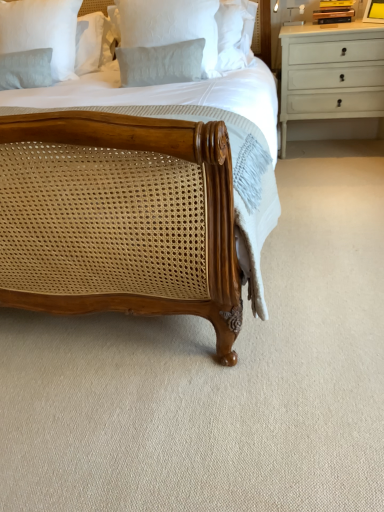
Question: From the image's perspective, is light gray textured pillow at upper left, positioned as the first pillow in left-to-right order, located above yellow matte picture frame at upper right?

Choices:
 (A) no
 (B) yes

Answer: (A)

Question: Is yellow matte picture frame at upper right surrounded by light gray textured pillow at upper left, arranged as the 1th pillow when viewed from the back?

Choices:
 (A) yes
 (B) no

Answer: (B)

Question: From the image's perspective, does light gray textured pillow at upper left, which is the second pillow from right to left, appear lower than yellow matte picture frame at upper right?

Choices:
 (A) yes
 (B) no

Answer: (A)

Question: From a real-world perspective, is light gray textured pillow at upper left, positioned as the first pillow in left-to-right order, on top of yellow matte picture frame at upper right?

Choices:
 (A) yes
 (B) no

Answer: (B)

Question: Considering the relative sizes of light gray textured pillow at upper left, arranged as the 1th pillow when viewed from the back, and yellow matte picture frame at upper right in the image provided, is light gray textured pillow at upper left, arranged as the 1th pillow when viewed from the back, smaller than yellow matte picture frame at upper right?

Choices:
 (A) yes
 (B) no

Answer: (B)

Question: Is point (211, 39) closer or farther from the camera than point (369, 19)?

Choices:
 (A) closer
 (B) farther

Answer: (A)

Question: Relative to yellow matte picture frame at upper right, is white textured pillow at upper center, the second pillow positioned from the left, in front or behind?

Choices:
 (A) front
 (B) behind

Answer: (A)

Question: Is white textured pillow at upper center, which is counted as the 2th pillow, starting from the back, taller or shorter than yellow matte picture frame at upper right?

Choices:
 (A) short
 (B) tall

Answer: (B)

Question: From a real-world perspective, is white textured pillow at upper center, the 1th pillow positioned from the front, physically located above or below yellow matte picture frame at upper right?

Choices:
 (A) above
 (B) below

Answer: (B)

Question: Considering the positions of white textured pillow at upper center, the second pillow positioned from the left, and light gray textured pillow at upper left, arranged as the 1th pillow when viewed from the back, in the image, is white textured pillow at upper center, the second pillow positioned from the left, taller or shorter than light gray textured pillow at upper left, arranged as the 1th pillow when viewed from the back,?

Choices:
 (A) tall
 (B) short

Answer: (B)

Question: From the image's perspective, is white textured pillow at upper center, the 1th pillow positioned from the front, located above or below light gray textured pillow at upper left, arranged as the 1th pillow when viewed from the back?

Choices:
 (A) below
 (B) above

Answer: (A)

Question: Looking at their shapes, would you say white textured pillow at upper center, placed as the first pillow when sorted from right to left, is wider or thinner than light gray textured pillow at upper left, the 2th pillow positioned from the front?

Choices:
 (A) thin
 (B) wide

Answer: (A)

Question: In the image, is white textured pillow at upper center, which is counted as the 2th pillow, starting from the back, on the left side or the right side of light gray textured pillow at upper left, which is the second pillow from right to left?

Choices:
 (A) left
 (B) right

Answer: (B)

Question: Is point (372, 18) positioned closer to the camera than point (64, 61)?

Choices:
 (A) closer
 (B) farther

Answer: (A)

Question: In the image, is yellow matte picture frame at upper right positioned in front of or behind light gray textured pillow at upper left, arranged as the 1th pillow when viewed from the back?

Choices:
 (A) behind
 (B) front

Answer: (A)